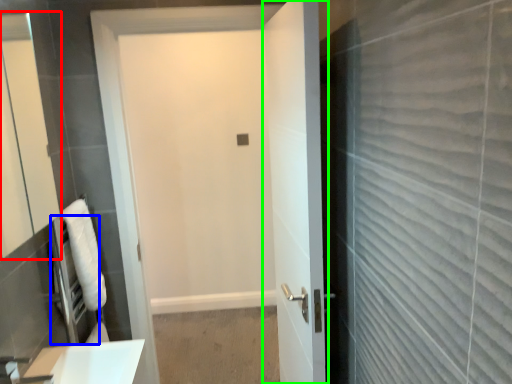
Question: Which object is the closest to the mirror (highlighted by a red box)? Choose among these: appliance (highlighted by a blue box) or door (highlighted by a green box).

Choices:
 (A) appliance
 (B) door

Answer: (A)